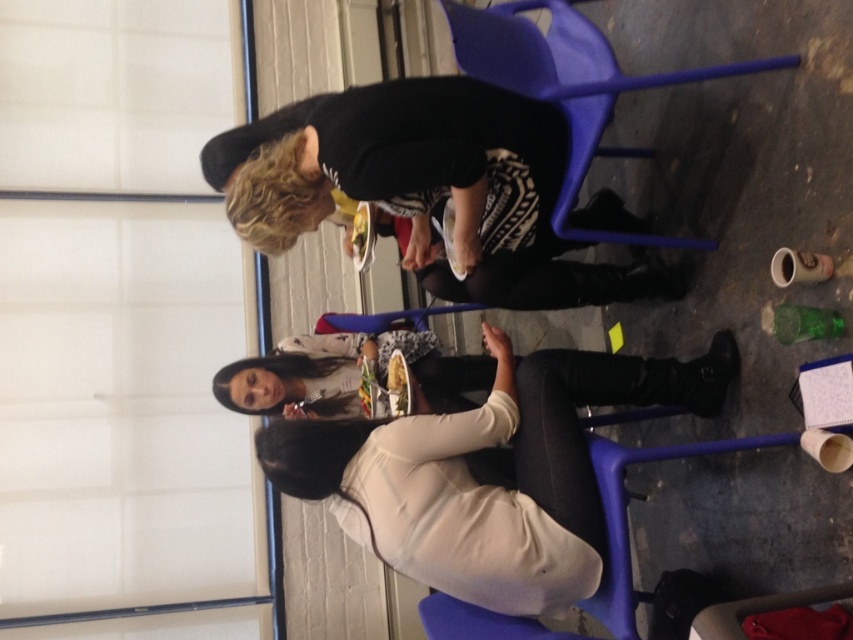
Which is behind, point (569, 216) or point (543, 282)?

Point (569, 216)

Is point (488, 70) farther from viewer compared to point (527, 257)?

That is False.

At what (x,y) coordinates should I click in order to perform the action: click on matte blue folding chair at center. Please return your answer as a coordinate pair (x, y). Looking at the image, I should click on (572, 88).

Is point (486, 461) positioned after point (596, 56)?

Yes, it is behind point (596, 56).

Between matte white sweater at center and matte blue folding chair at center, which one has more height?

Standing taller between the two is matte blue folding chair at center.

Which is in front, point (419, 545) or point (607, 147)?

Point (419, 545)

The height and width of the screenshot is (640, 853). Identify the location of matte white sweater at center. (489, 474).

Is matte white sweater at center bigger than black leather boots at lower center?

Indeed, matte white sweater at center has a larger size compared to black leather boots at lower center.

Can you confirm if matte white sweater at center is positioned to the left of black leather boots at lower center?

Correct, you'll find matte white sweater at center to the left of black leather boots at lower center.

Consider the image. Who is more distant from viewer, [561,596] or [537,305]?

The point [537,305] is behind.

This screenshot has height=640, width=853. I want to click on matte white sweater at center, so click(489, 474).